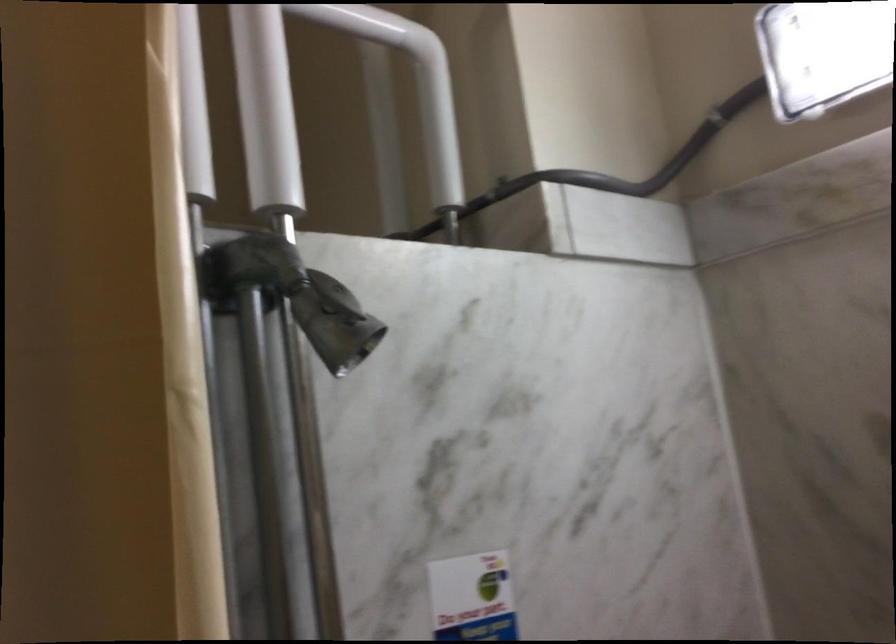
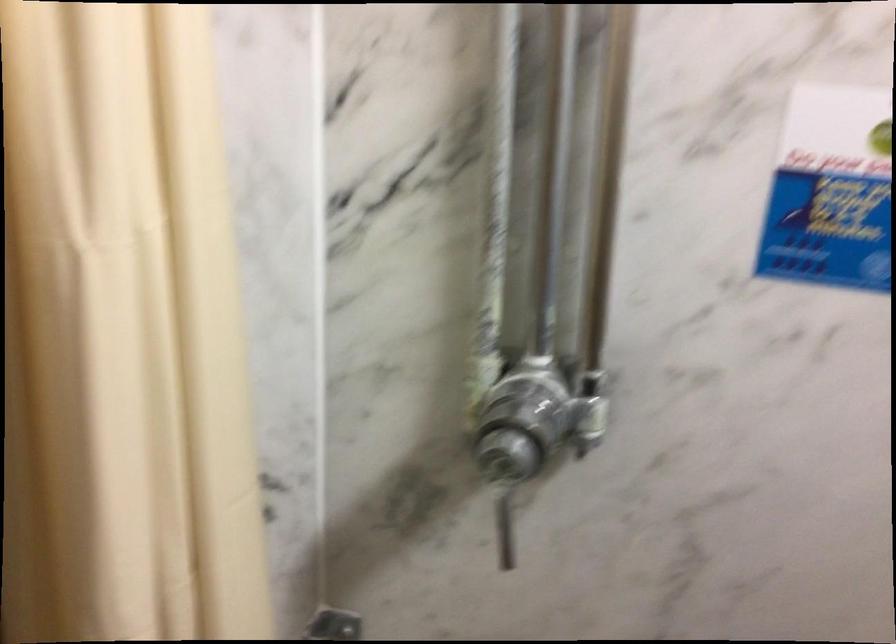
Question: The images are taken continuously from a first-person perspective. In which direction are you moving?

Choices:
 (A) Left
 (B) Right
 (C) Forward
 (D) Backward

Answer: (D)